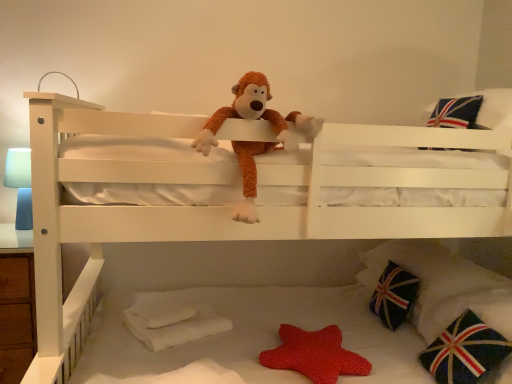
Question: Can you confirm if blue matte table lamp at left is wider than union jack fabric pillow at upper right, which is the fourth pillow from bottom to top?

Choices:
 (A) yes
 (B) no

Answer: (B)

Question: From the image's perspective, is blue matte table lamp at left located beneath union jack fabric pillow at upper right, placed as the 1th pillow when sorted from top to bottom?

Choices:
 (A) no
 (B) yes

Answer: (B)

Question: Is union jack fabric pillow at upper right, which is the fourth pillow from bottom to top, located within blue matte table lamp at left?

Choices:
 (A) yes
 (B) no

Answer: (B)

Question: Can you confirm if blue matte table lamp at left is positioned to the left of union jack fabric pillow at upper right, placed as the 1th pillow when sorted from top to bottom?

Choices:
 (A) yes
 (B) no

Answer: (A)

Question: Considering the relative sizes of blue matte table lamp at left and union jack fabric pillow at upper right, which is the fourth pillow from bottom to top, in the image provided, is blue matte table lamp at left thinner than union jack fabric pillow at upper right, which is the fourth pillow from bottom to top,?

Choices:
 (A) yes
 (B) no

Answer: (A)

Question: Would you say red dotted fabric star at lower center, the 2th toy positioned from the top, is to the left or to the right of dark blue fabric pillow with union jack design at lower right, which is the second pillow in bottom-to-top order, in the picture?

Choices:
 (A) right
 (B) left

Answer: (B)

Question: Relative to dark blue fabric pillow with union jack design at lower right, which is the second pillow in bottom-to-top order, is red dotted fabric star at lower center, the 2th toy positioned from the top, in front or behind?

Choices:
 (A) behind
 (B) front

Answer: (B)

Question: Looking at their shapes, would you say red dotted fabric star at lower center, the 1th toy from the back, is wider or thinner than dark blue fabric pillow with union jack design at lower right, the third pillow in the top-to-bottom sequence?

Choices:
 (A) thin
 (B) wide

Answer: (B)

Question: From the image's perspective, is red dotted fabric star at lower center, the second toy from the front, positioned above or below dark blue fabric pillow with union jack design at lower right, which is the second pillow in bottom-to-top order?

Choices:
 (A) below
 (B) above

Answer: (A)

Question: From a real-world perspective, is fluffy brown monkey at center, the 2th toy in the back-to-front sequence, above or below blue matte table lamp at left?

Choices:
 (A) above
 (B) below

Answer: (A)

Question: Is point (258, 82) closer or farther from the camera than point (22, 205)?

Choices:
 (A) closer
 (B) farther

Answer: (A)

Question: Is fluffy brown monkey at center, positioned as the 1th toy in front-to-back order, wider or thinner than blue matte table lamp at left?

Choices:
 (A) wide
 (B) thin

Answer: (A)

Question: From the image's perspective, is fluffy brown monkey at center, the second toy ordered from the bottom, positioned above or below blue matte table lamp at left?

Choices:
 (A) below
 (B) above

Answer: (B)

Question: Is point (300, 372) positioned closer to the camera than point (419, 251)?

Choices:
 (A) farther
 (B) closer

Answer: (B)

Question: From the image's perspective, relative to dark blue fabric pillow with union jack design at lower right, arranged as the 3th pillow when ordered from the bottom, is red dotted fabric star at lower center, the 2th toy positioned from the top, above or below?

Choices:
 (A) above
 (B) below

Answer: (B)